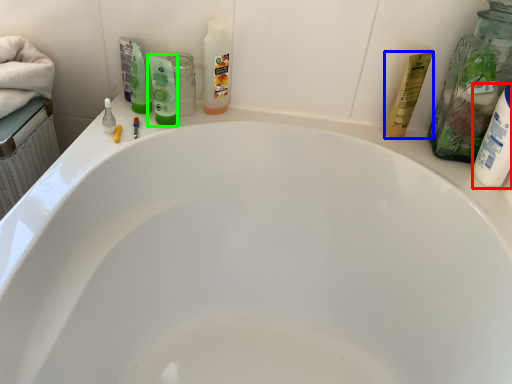
Question: Which object is the farthest from toiletry (highlighted by a red box)? Choose among these: toiletry (highlighted by a blue box) or mouthwash (highlighted by a green box).

Choices:
 (A) toiletry
 (B) mouthwash

Answer: (B)